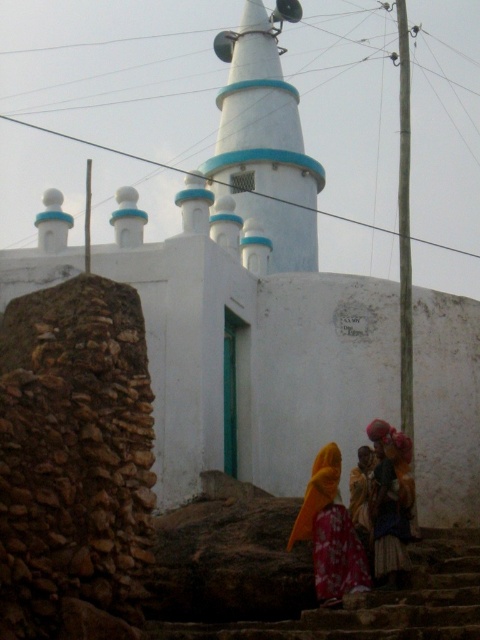
Question: Which of the following is the closest to the observer?

Choices:
 (A) (342, 596)
 (B) (397, 602)
 (C) (339, 516)
 (D) (287, 145)

Answer: (B)

Question: Is white painted tower at center positioned at the back of floral fabric dress at lower center?

Choices:
 (A) yes
 (B) no

Answer: (A)

Question: Which point is closer to the camera?

Choices:
 (A) (257, 22)
 (B) (345, 548)

Answer: (B)

Question: Which point is closer to the camera?

Choices:
 (A) orange fabric headscarf at lower right
 (B) white painted tower at center

Answer: (A)

Question: From the image, what is the correct spatial relationship of white painted tower at center in relation to floral fabric dress at lower center?

Choices:
 (A) above
 (B) below

Answer: (A)

Question: Is stone stairs at lower center below orange fabric headscarf at lower center?

Choices:
 (A) no
 (B) yes

Answer: (B)